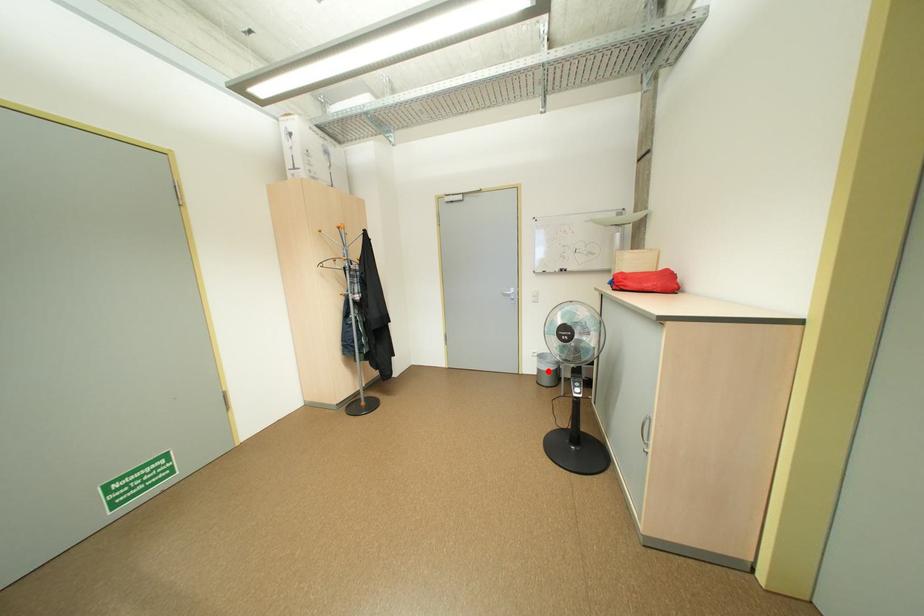
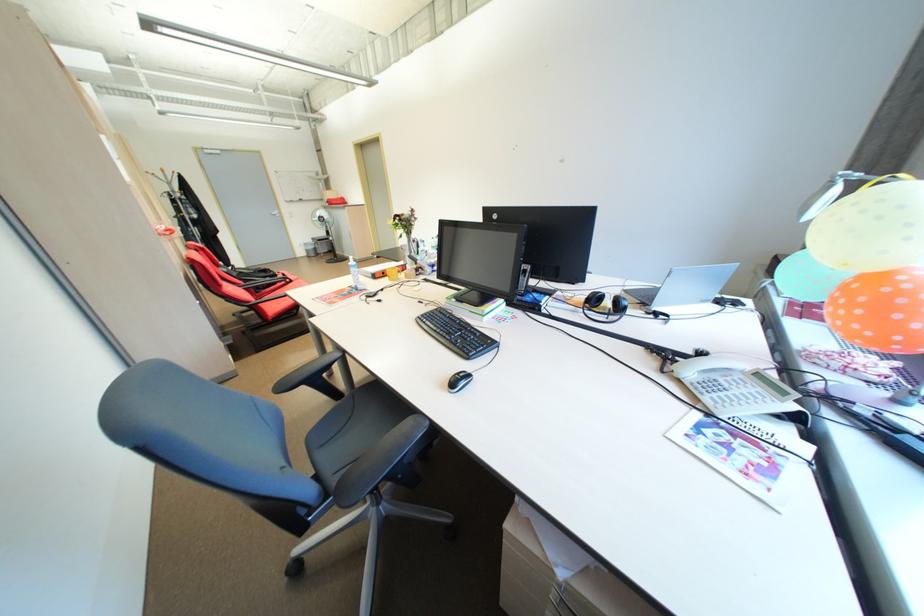
In the second image, find the point that corresponds to the highlighted location in the first image.

(315, 252)